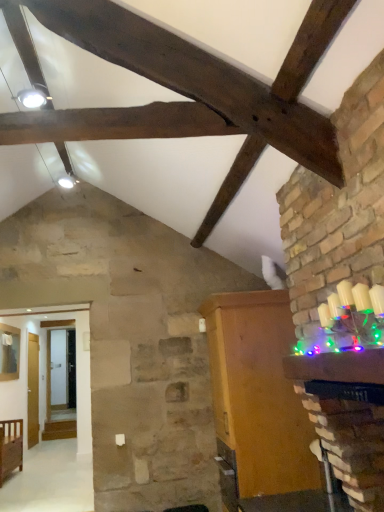
Question: From the image's perspective, would you say brown wooden cabinet at upper center is shown under wooden crib at lower left, positioned as the 2th furniture in right-to-left order?

Choices:
 (A) yes
 (B) no

Answer: (B)

Question: Is brown wooden cabinet at upper center located outside wooden crib at lower left, positioned as the first furniture in left-to-right order?

Choices:
 (A) yes
 (B) no

Answer: (A)

Question: Is brown wooden cabinet at upper center bigger than wooden crib at lower left, positioned as the first furniture in left-to-right order?

Choices:
 (A) no
 (B) yes

Answer: (B)

Question: Does brown wooden cabinet at upper center have a greater width compared to wooden crib at lower left, the 2th furniture in the front-to-back sequence?

Choices:
 (A) no
 (B) yes

Answer: (A)

Question: Could you tell me if brown wooden cabinet at upper center is facing wooden crib at lower left, acting as the second furniture starting from the top?

Choices:
 (A) no
 (B) yes

Answer: (B)

Question: Is brown wooden cabinet at upper center taller than wooden crib at lower left, the 2th furniture in the front-to-back sequence?

Choices:
 (A) no
 (B) yes

Answer: (B)

Question: Is the depth of wooden cabinet at right, positioned as the second furniture in left-to-right order, greater than that of wooden crib at lower left, positioned as the 2th furniture in right-to-left order?

Choices:
 (A) yes
 (B) no

Answer: (B)

Question: Is wooden cabinet at right, which is the first furniture from front to back, directly adjacent to wooden crib at lower left, positioned as the first furniture in left-to-right order?

Choices:
 (A) yes
 (B) no

Answer: (B)

Question: Is wooden cabinet at right, which is the first furniture from front to back, not near wooden crib at lower left, acting as the second furniture starting from the top?

Choices:
 (A) yes
 (B) no

Answer: (A)

Question: Can you confirm if wooden cabinet at right, positioned as the second furniture in left-to-right order, is smaller than wooden crib at lower left, acting as the second furniture starting from the top?

Choices:
 (A) yes
 (B) no

Answer: (B)

Question: Does wooden cabinet at right, which is the first furniture from front to back, contain wooden crib at lower left, positioned as the first furniture in left-to-right order?

Choices:
 (A) yes
 (B) no

Answer: (B)

Question: Considering the relative sizes of wooden cabinet at right, the second furniture viewed from the back, and wooden crib at lower left, positioned as the 1th furniture in back-to-front order, in the image provided, is wooden cabinet at right, the second furniture viewed from the back, bigger than wooden crib at lower left, positioned as the 1th furniture in back-to-front order,?

Choices:
 (A) no
 (B) yes

Answer: (B)

Question: Considering the relative positions of wooden cabinet at right, the 1th furniture when ordered from top to bottom, and brown wooden cabinet at upper center in the image provided, is wooden cabinet at right, the 1th furniture when ordered from top to bottom, behind brown wooden cabinet at upper center?

Choices:
 (A) no
 (B) yes

Answer: (B)